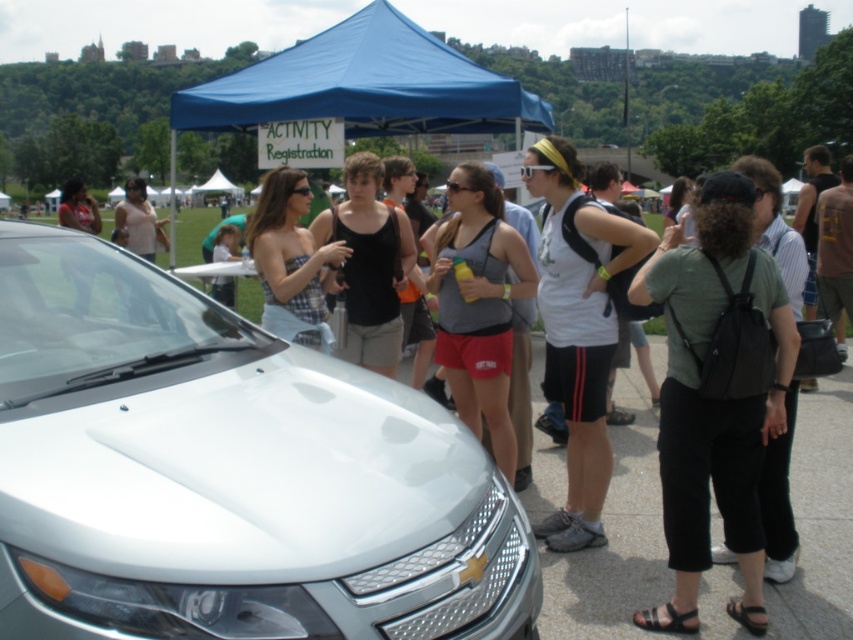
You are a photographer at the event and need to take a full body portrait of the person wearing the plaid fabric dress at center. Can you position them in front of the white glossy car at center without cropping the top of their head?

The white glossy car at center is much taller than the plaid fabric dress at center, so yes, you can position the person in front of the white glossy car at center without cropping the top of their head since the car is taller.

You are organizing an outdoor event and need to place a new banner between the green fabric backpack at right and the blue fabric canopy at upper center. Based on their widths, which object should the banner be placed closer to to ensure it fits better?

The green fabric backpack at right has a smaller width than the blue fabric canopy at upper center, so the banner should be placed closer to the green fabric backpack at right to ensure it fits better.